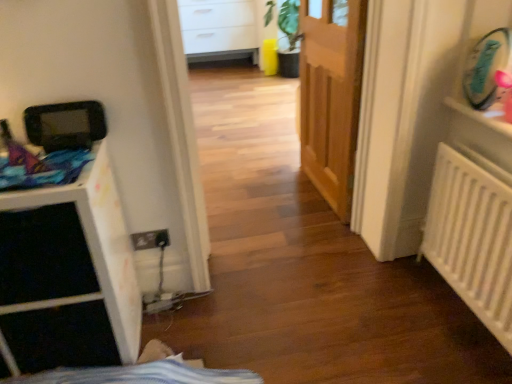
Question: Is white matte file cabinet at left facing towards white matte radiator at right?

Choices:
 (A) yes
 (B) no

Answer: (B)

Question: Considering the relative sizes of white matte file cabinet at left and white matte radiator at right in the image provided, is white matte file cabinet at left wider than white matte radiator at right?

Choices:
 (A) no
 (B) yes

Answer: (B)

Question: Is white matte file cabinet at left outside of white matte radiator at right?

Choices:
 (A) no
 (B) yes

Answer: (B)

Question: Does white matte file cabinet at left have a larger size compared to white matte radiator at right?

Choices:
 (A) no
 (B) yes

Answer: (B)

Question: From a real-world perspective, is white matte file cabinet at left beneath white matte radiator at right?

Choices:
 (A) no
 (B) yes

Answer: (A)

Question: Visually, is white plastic shelf at upper right positioned to the left or to the right of white matte file cabinet at left?

Choices:
 (A) right
 (B) left

Answer: (A)

Question: From a real-world perspective, relative to white matte file cabinet at left, is white plastic shelf at upper right vertically above or below?

Choices:
 (A) below
 (B) above

Answer: (B)

Question: Relative to white matte file cabinet at left, is white plastic shelf at upper right in front or behind?

Choices:
 (A) behind
 (B) front

Answer: (A)

Question: From the image's perspective, is white plastic shelf at upper right above or below white matte file cabinet at left?

Choices:
 (A) above
 (B) below

Answer: (A)

Question: Does point (106, 236) appear closer or farther from the camera than point (482, 122)?

Choices:
 (A) closer
 (B) farther

Answer: (A)

Question: Is white matte file cabinet at left in front of or behind white plastic shelf at upper right in the image?

Choices:
 (A) front
 (B) behind

Answer: (A)

Question: Looking at the image, does white matte file cabinet at left seem bigger or smaller compared to white plastic shelf at upper right?

Choices:
 (A) big
 (B) small

Answer: (A)

Question: Visually, is white matte file cabinet at left positioned to the left or to the right of white plastic shelf at upper right?

Choices:
 (A) right
 (B) left

Answer: (B)

Question: From a real-world perspective, is white matte radiator at right positioned above or below wooden door at center?

Choices:
 (A) below
 (B) above

Answer: (A)

Question: From the image's perspective, relative to wooden door at center, is white matte radiator at right above or below?

Choices:
 (A) above
 (B) below

Answer: (B)